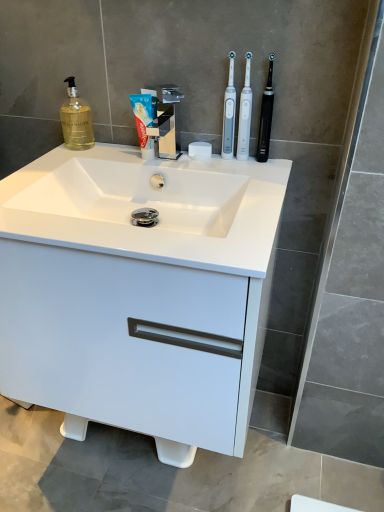
Question: From the image's perspective, is white plastic toothbrush at upper right, arranged as the third toothbrush when viewed from the right, located above translucent glass soap dispenser at upper left?

Choices:
 (A) no
 (B) yes

Answer: (A)

Question: Considering the relative positions of white plastic toothbrush at upper right, the first toothbrush positioned from the left, and translucent glass soap dispenser at upper left in the image provided, is white plastic toothbrush at upper right, the first toothbrush positioned from the left, in front of translucent glass soap dispenser at upper left?

Choices:
 (A) no
 (B) yes

Answer: (B)

Question: Is white plastic toothbrush at upper right, arranged as the third toothbrush when viewed from the right, far from translucent glass soap dispenser at upper left?

Choices:
 (A) no
 (B) yes

Answer: (A)

Question: From a real-world perspective, is white plastic toothbrush at upper right, the first toothbrush positioned from the left, positioned under translucent glass soap dispenser at upper left based on gravity?

Choices:
 (A) no
 (B) yes

Answer: (A)

Question: Considering the relative positions of white plastic toothbrush at upper right, arranged as the third toothbrush when viewed from the right, and translucent glass soap dispenser at upper left in the image provided, is white plastic toothbrush at upper right, arranged as the third toothbrush when viewed from the right, to the right of translucent glass soap dispenser at upper left from the viewer's perspective?

Choices:
 (A) yes
 (B) no

Answer: (A)

Question: Is black rubberized toothbrush at upper right, placed as the 1th toothbrush when sorted from right to left, inside or outside of polished chrome faucet at center?

Choices:
 (A) inside
 (B) outside

Answer: (B)

Question: From the image's perspective, is black rubberized toothbrush at upper right, placed as the 1th toothbrush when sorted from right to left, located above or below polished chrome faucet at center?

Choices:
 (A) below
 (B) above

Answer: (B)

Question: From their relative heights in the image, would you say black rubberized toothbrush at upper right, placed as the 1th toothbrush when sorted from right to left, is taller or shorter than polished chrome faucet at center?

Choices:
 (A) short
 (B) tall

Answer: (B)

Question: Visually, is black rubberized toothbrush at upper right, placed as the 1th toothbrush when sorted from right to left, positioned to the left or to the right of polished chrome faucet at center?

Choices:
 (A) right
 (B) left

Answer: (A)

Question: Would you say translucent glass soap dispenser at upper left is inside or outside black rubberized toothbrush at upper right, which ranks as the third toothbrush in left-to-right order?

Choices:
 (A) outside
 (B) inside

Answer: (A)

Question: Is point (81, 147) positioned closer to the camera than point (269, 61)?

Choices:
 (A) closer
 (B) farther

Answer: (B)

Question: From a real-world perspective, is translucent glass soap dispenser at upper left physically located above or below black rubberized toothbrush at upper right, placed as the 1th toothbrush when sorted from right to left?

Choices:
 (A) below
 (B) above

Answer: (A)

Question: In the image, is translucent glass soap dispenser at upper left on the left side or the right side of black rubberized toothbrush at upper right, which ranks as the third toothbrush in left-to-right order?

Choices:
 (A) left
 (B) right

Answer: (A)

Question: Would you say white plastic toothbrush at upper right, the first toothbrush positioned from the left, is inside or outside white matte soap at center?

Choices:
 (A) inside
 (B) outside

Answer: (B)

Question: From a real-world perspective, is white plastic toothbrush at upper right, arranged as the third toothbrush when viewed from the right, above or below white matte soap at center?

Choices:
 (A) below
 (B) above

Answer: (B)